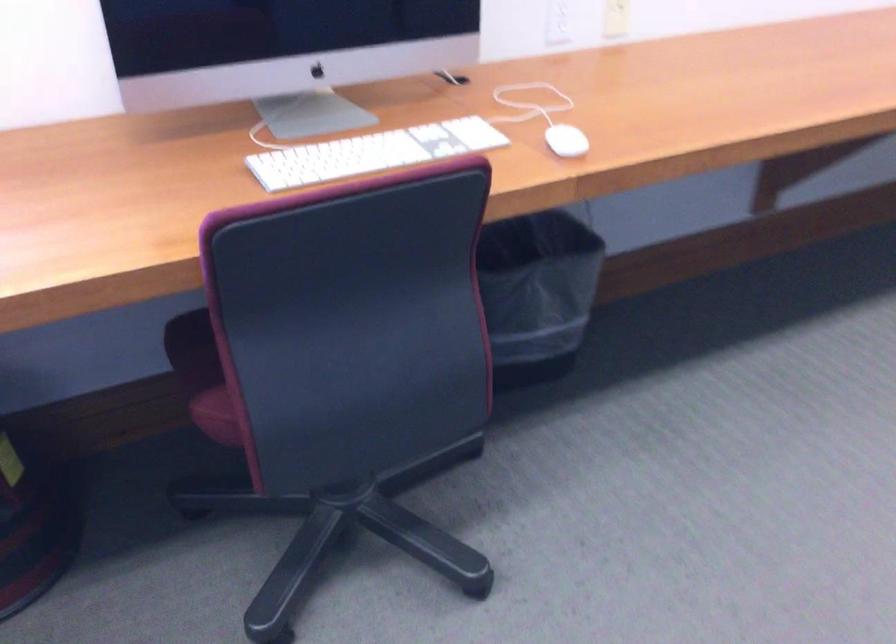
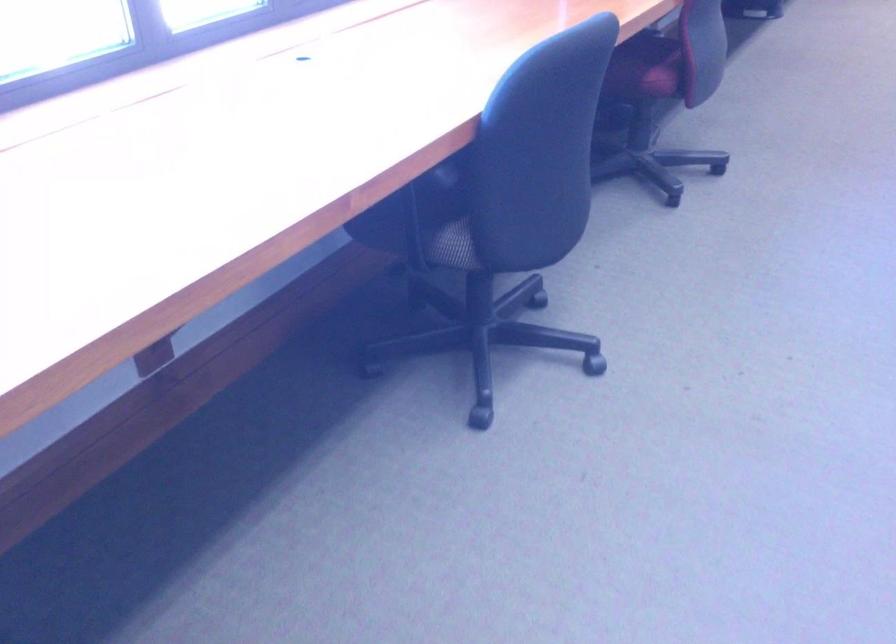
In a continuous first-person perspective shot, in which direction is the camera moving?

The movement direction of the cameraman is left, backward.